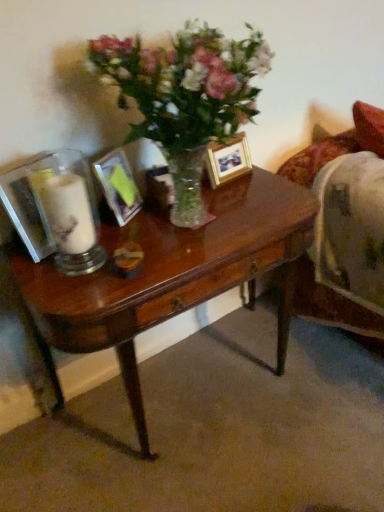
Locate an element on the screen. free spot to the right of metallic silver picture frame at center, the 2th picture frame from the right is located at coordinates (166, 215).